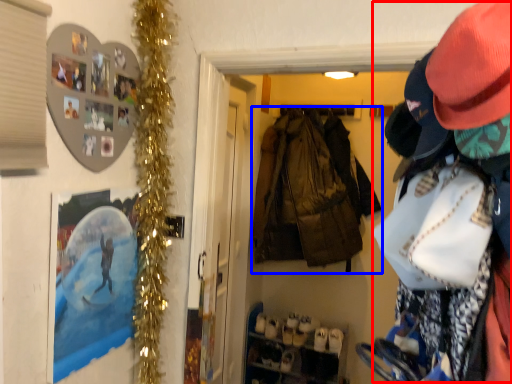
Question: Which object appears closest to the camera in this image, person (highlighted by a red box) or jacket (highlighted by a blue box)?

Choices:
 (A) person
 (B) jacket

Answer: (A)